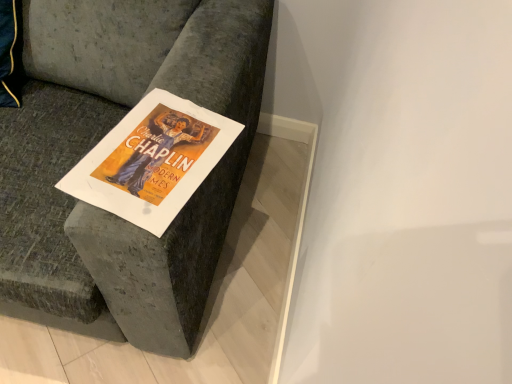
Question: From the image's perspective, is velvet gray couch at upper left above orange paper poster at center?

Choices:
 (A) yes
 (B) no

Answer: (A)

Question: Is velvet gray couch at upper left oriented towards orange paper poster at center?

Choices:
 (A) yes
 (B) no

Answer: (A)

Question: Considering the relative positions of velvet gray couch at upper left and orange paper poster at center in the image provided, is velvet gray couch at upper left behind orange paper poster at center?

Choices:
 (A) yes
 (B) no

Answer: (B)

Question: Is velvet gray couch at upper left thinner than orange paper poster at center?

Choices:
 (A) yes
 (B) no

Answer: (B)

Question: Does velvet gray couch at upper left have a greater height compared to orange paper poster at center?

Choices:
 (A) yes
 (B) no

Answer: (A)

Question: Considering the relative positions of velvet gray couch at upper left and orange paper poster at center in the image provided, is velvet gray couch at upper left to the left of orange paper poster at center from the viewer's perspective?

Choices:
 (A) no
 (B) yes

Answer: (B)

Question: Considering the relative sizes of orange paper poster at center and velvet gray couch at upper left in the image provided, is orange paper poster at center thinner than velvet gray couch at upper left?

Choices:
 (A) no
 (B) yes

Answer: (B)

Question: From a real-world perspective, is orange paper poster at center below velvet gray couch at upper left?

Choices:
 (A) no
 (B) yes

Answer: (A)

Question: From the image's perspective, does orange paper poster at center appear higher than velvet gray couch at upper left?

Choices:
 (A) yes
 (B) no

Answer: (B)

Question: Does orange paper poster at center come in front of velvet gray couch at upper left?

Choices:
 (A) yes
 (B) no

Answer: (B)

Question: Can you confirm if orange paper poster at center is positioned to the right of velvet gray couch at upper left?

Choices:
 (A) yes
 (B) no

Answer: (A)

Question: Does orange paper poster at center touch velvet gray couch at upper left?

Choices:
 (A) no
 (B) yes

Answer: (A)

Question: Based on their sizes in the image, would you say orange paper poster at center is bigger or smaller than velvet gray couch at upper left?

Choices:
 (A) big
 (B) small

Answer: (B)